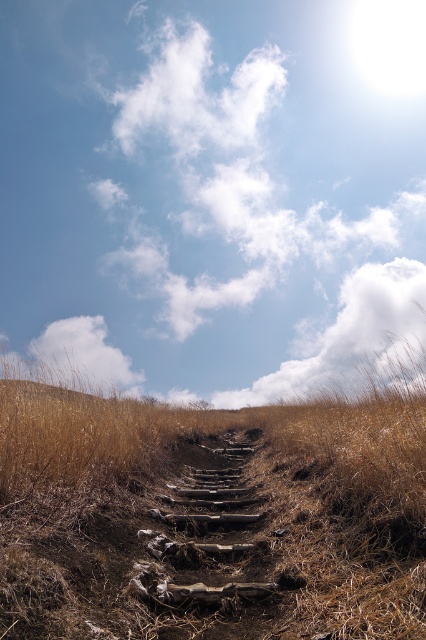
Does brown dry grass at center appear on the right side of white fluffy cloud at upper center?

No, brown dry grass at center is not to the right of white fluffy cloud at upper center.

Is the position of brown dry grass at center more distant than that of white fluffy cloud at upper center?

That is False.

Which is in front, point (40, 476) or point (377, 314)?

Point (40, 476) is in front.

I want to click on brown dry grass at center, so click(215, 513).

Can you confirm if blue sky at upper center is positioned to the right of white fluffy cloud at upper left?

Yes, blue sky at upper center is to the right of white fluffy cloud at upper left.

Who is more forward, (x=180, y=280) or (x=68, y=365)?

Point (x=68, y=365) is in front.

Locate an element on the screen. Image resolution: width=426 pixels, height=640 pixels. blue sky at upper center is located at coordinates (212, 189).

Is blue sky at upper center behind white fluffy cloud at upper center?

No, blue sky at upper center is in front of white fluffy cloud at upper center.

Can you confirm if blue sky at upper center is positioned below white fluffy cloud at upper center?

Actually, blue sky at upper center is above white fluffy cloud at upper center.

What do you see at coordinates (212, 189) in the screenshot? I see `blue sky at upper center` at bounding box center [212, 189].

Locate an element on the screen. This screenshot has width=426, height=640. blue sky at upper center is located at coordinates (212, 189).